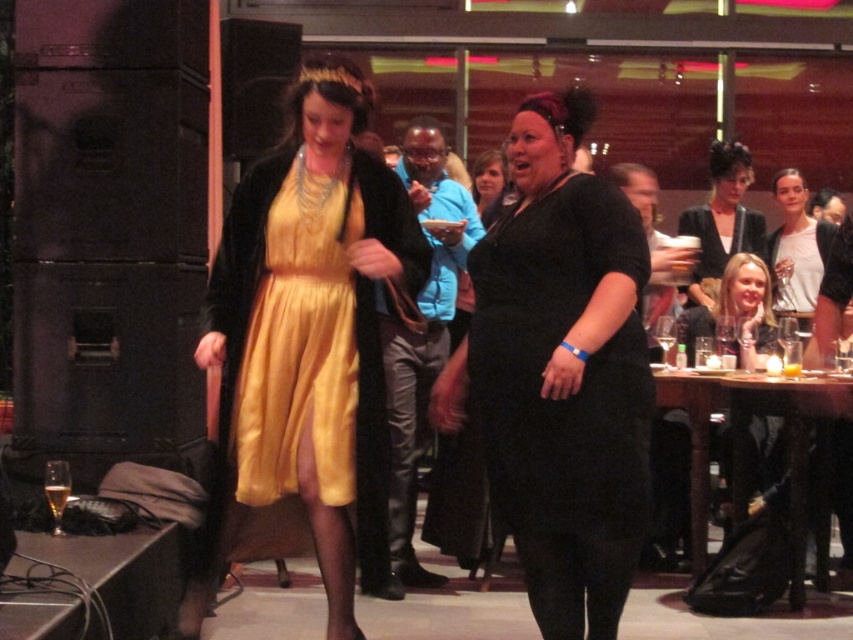
You are at a party and want to take a photo of both the satin yellow dress at center and the white matte shirt at upper right. Which one should you focus on first to capture both in the frame?

You should focus on the satin yellow dress at center first since it is positioned to the left of the white matte shirt at upper right, allowing you to adjust the camera to include both in the frame.

You are at a party and want to find the matte black dress at lower right. Which direction should you move from the matte black dress at center?

To locate the matte black dress at lower right from the matte black dress at center, you should move to the right since the matte black dress at lower right is positioned to the right of the matte black dress at center.

You are at the event and want to take a photo of the point at coordinates (x=674, y=433). If your camera has a maximum focus range of 4 meters, will it be able to focus on that point?

The point at coordinates (x=674, y=433) is 4.57 meters away from the camera, which exceeds the maximum focus range of 4 meters. Therefore, the camera cannot focus on that point.